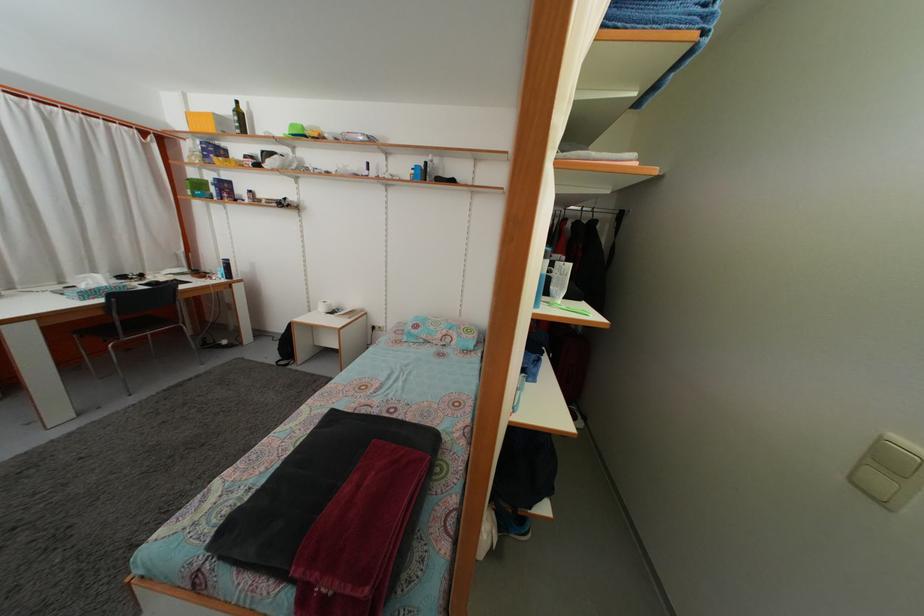
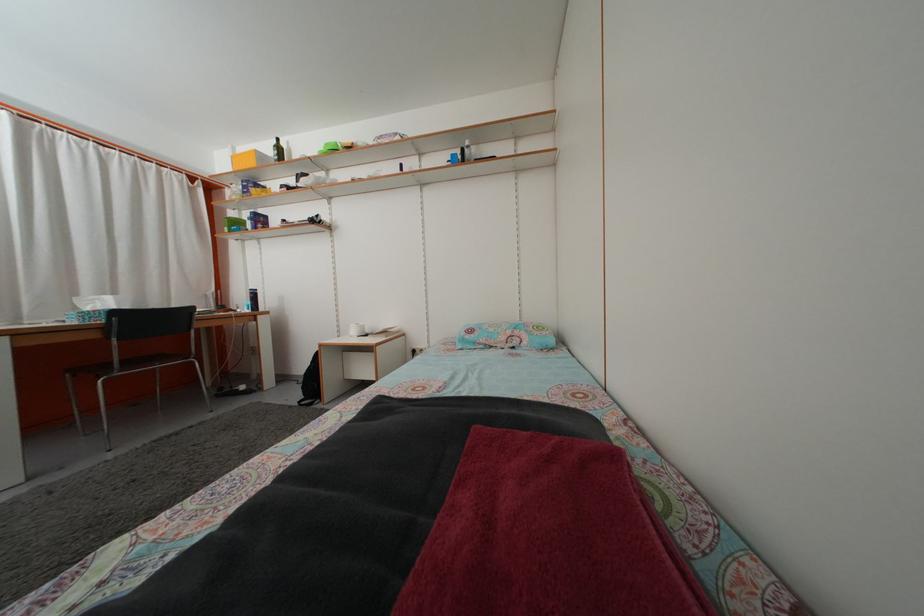
In the second image, find the point that corresponds to the point at 198,180 in the first image.

(237, 223)